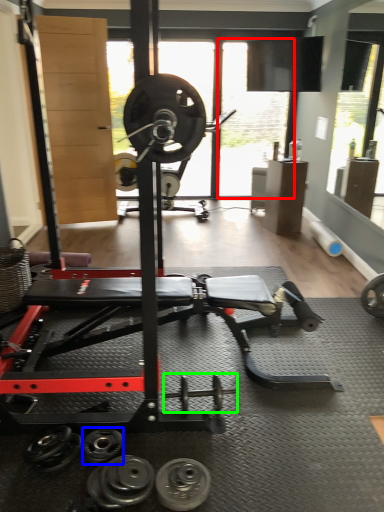
Question: Estimate the real-world distances between objects in this image. Which object is farther from window screen (highlighted by a red box), dumbbell (highlighted by a blue box) or dumbbell (highlighted by a green box)?

Choices:
 (A) dumbbell
 (B) dumbbell

Answer: (A)